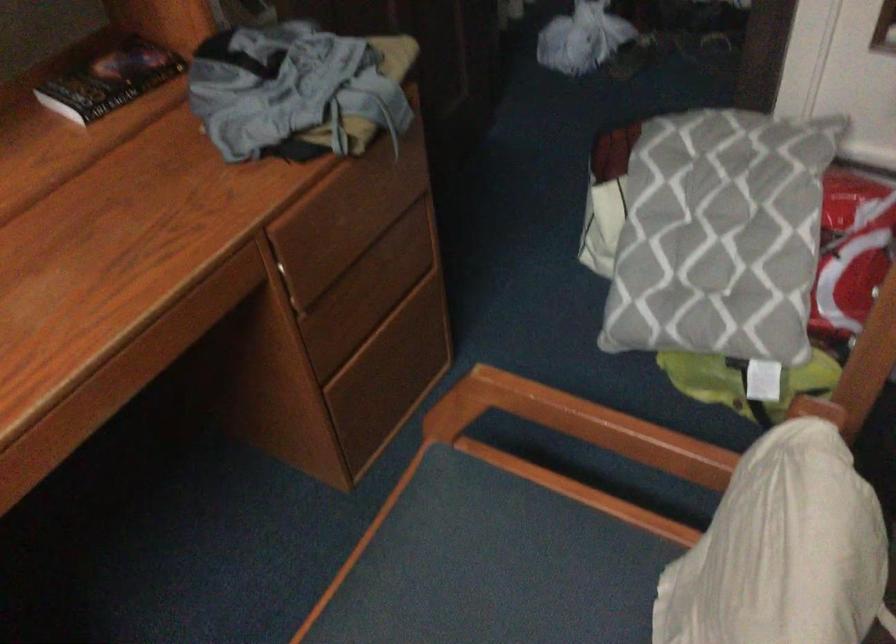
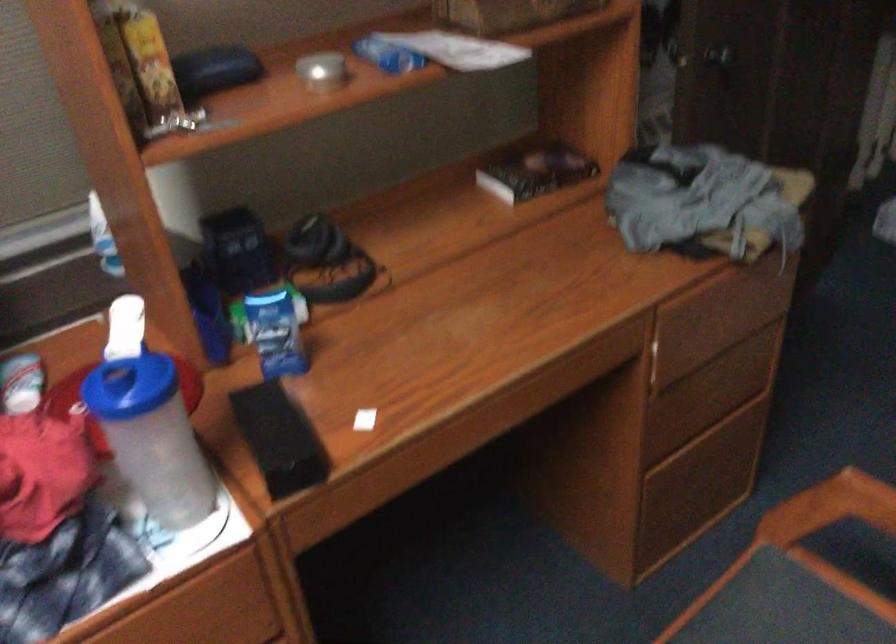
Where in the second image is the point corresponding to pixel 112 82 from the first image?

(536, 172)